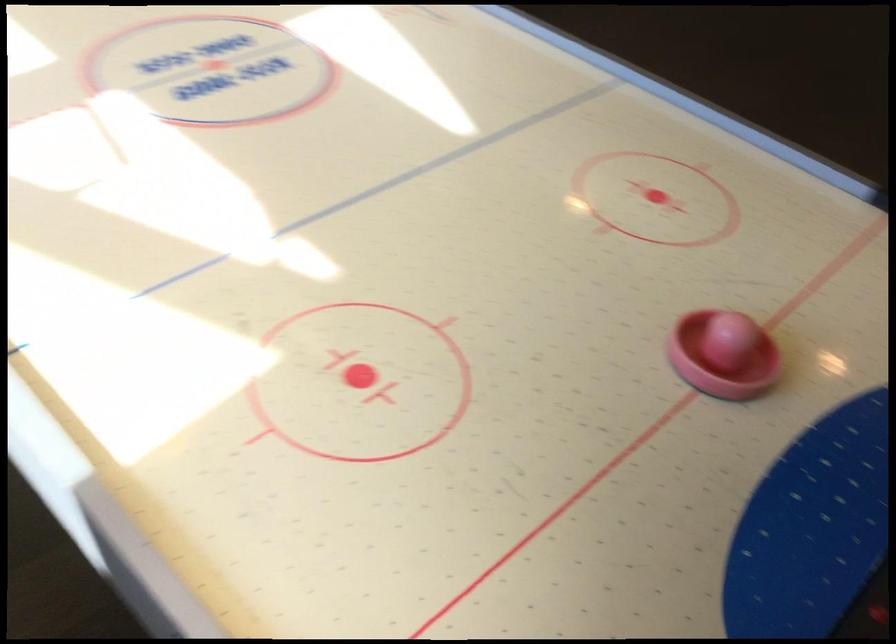
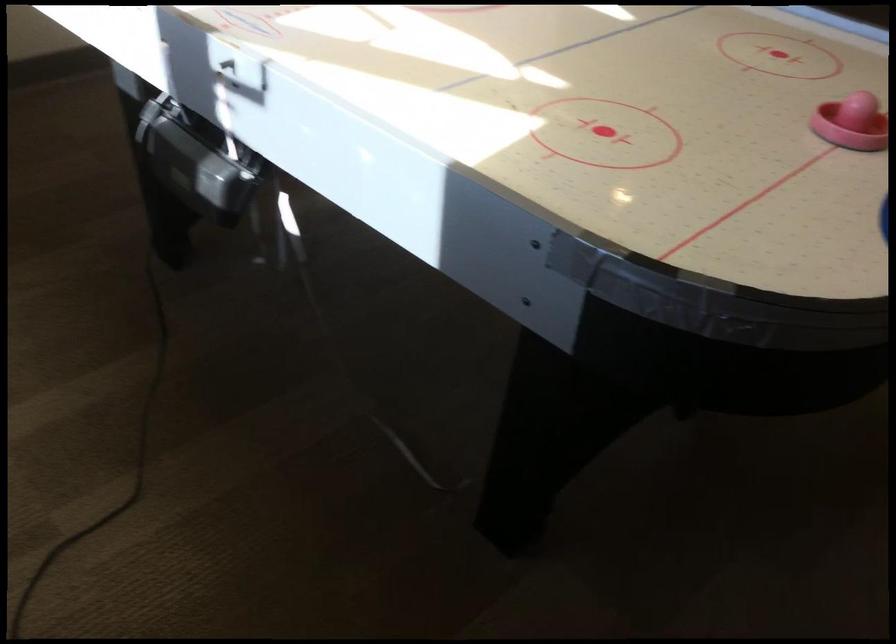
Question: How did the camera likely rotate?

Choices:
 (A) Left
 (B) Right
 (C) Up
 (D) Down

Answer: (C)